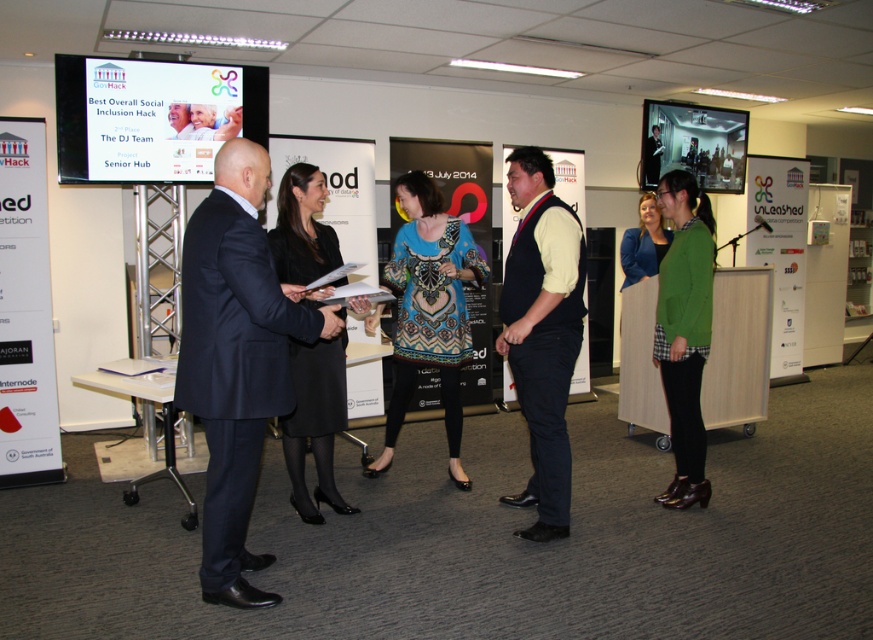
Looking at this image, you are organizing a photo shoot and need to decide whether to place a prop on the black matte vest at center or the white paper at left. Based on their sizes, which object can accommodate a larger prop?

The black matte vest at center is larger in size than the white paper at left, so it can accommodate a larger prop.

You are attending an awards ceremony and notice two attendees wearing blue clothing. The first is a dark blue suit at center, and the second is a blue velvet jacket at center. From your perspective, which one is positioned to the left?

The dark blue suit at center is to the left of the blue velvet jacket at center.